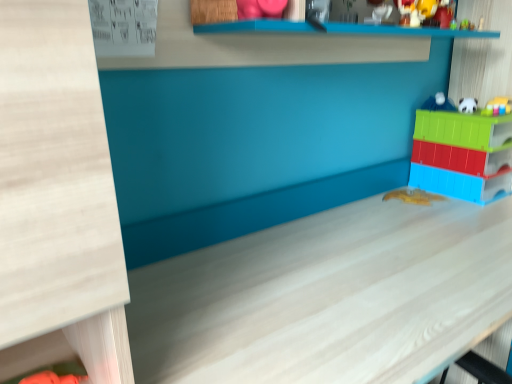
Question: Is green plastic toy at upper right, the 3th toy positioned from the top, located outside translucent plastic toy at right, which ranks as the 4th toy in top-to-bottom order?

Choices:
 (A) yes
 (B) no

Answer: (A)

Question: Is green plastic toy at upper right, positioned as the third toy in bottom-to-top order, taller than translucent plastic toy at right, the second toy from the bottom?

Choices:
 (A) yes
 (B) no

Answer: (B)

Question: Does green plastic toy at upper right, positioned as the third toy in bottom-to-top order, turn towards translucent plastic toy at right, the second toy from the bottom?

Choices:
 (A) yes
 (B) no

Answer: (B)

Question: Is green plastic toy at upper right, the 3th toy positioned from the top, next to translucent plastic toy at right, which ranks as the 4th toy in top-to-bottom order, and touching it?

Choices:
 (A) no
 (B) yes

Answer: (A)

Question: Considering the relative sizes of green plastic toy at upper right, positioned as the third toy in bottom-to-top order, and translucent plastic toy at right, the second toy from the bottom, in the image provided, is green plastic toy at upper right, positioned as the third toy in bottom-to-top order, bigger than translucent plastic toy at right, the second toy from the bottom,?

Choices:
 (A) no
 (B) yes

Answer: (A)

Question: Considering the positions of white matte table at center and translucent plastic toy at right, the second toy from the bottom, in the image, is white matte table at center wider or thinner than translucent plastic toy at right, the second toy from the bottom,?

Choices:
 (A) wide
 (B) thin

Answer: (A)

Question: Is white matte table at center inside or outside of translucent plastic toy at right, the second toy from the bottom?

Choices:
 (A) inside
 (B) outside

Answer: (B)

Question: From the image's perspective, is white matte table at center positioned above or below translucent plastic toy at right, the second toy from the bottom?

Choices:
 (A) below
 (B) above

Answer: (A)

Question: Looking at the image, does white matte table at center seem bigger or smaller compared to translucent plastic toy at right, which ranks as the 4th toy in top-to-bottom order?

Choices:
 (A) small
 (B) big

Answer: (B)

Question: Considering the positions of white glossy ball at upper right, which ranks as the 5th toy in bottom-to-top order, and green plastic toy at upper right, the 3th toy positioned from the top, in the image, is white glossy ball at upper right, which ranks as the 5th toy in bottom-to-top order, bigger or smaller than green plastic toy at upper right, the 3th toy positioned from the top,?

Choices:
 (A) small
 (B) big

Answer: (B)

Question: Considering the positions of point (435, 109) and point (489, 105), is point (435, 109) closer or farther from the camera than point (489, 105)?

Choices:
 (A) closer
 (B) farther

Answer: (B)

Question: From the image's perspective, is white glossy ball at upper right, which ranks as the first toy in top-to-bottom order, positioned above or below green plastic toy at upper right, the 3th toy positioned from the top?

Choices:
 (A) below
 (B) above

Answer: (B)

Question: Is white glossy ball at upper right, which ranks as the first toy in top-to-bottom order, to the left or to the right of green plastic toy at upper right, the 3th toy positioned from the top, in the image?

Choices:
 (A) left
 (B) right

Answer: (A)

Question: Is point (441, 104) closer or farther from the camera than point (326, 233)?

Choices:
 (A) closer
 (B) farther

Answer: (B)

Question: From the image's perspective, is white glossy ball at upper right, which ranks as the 5th toy in bottom-to-top order, positioned above or below white matte table at center?

Choices:
 (A) above
 (B) below

Answer: (A)